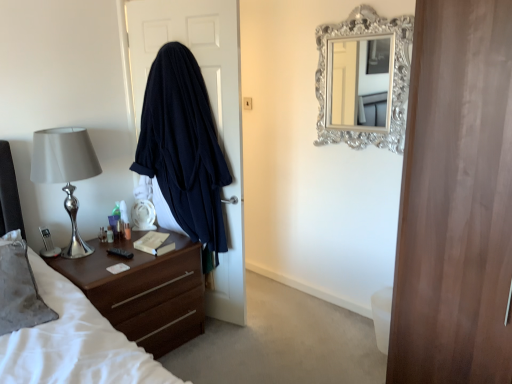
Question: Can you confirm if black plastic remote control at left is positioned to the right of translucent plastic bottle at left, which is the second bottle from right to left?

Choices:
 (A) yes
 (B) no

Answer: (A)

Question: Does black plastic remote control at left have a larger size compared to translucent plastic bottle at left, which appears as the 2th bottle when viewed from the left?

Choices:
 (A) yes
 (B) no

Answer: (A)

Question: Is black plastic remote control at left outside translucent plastic bottle at left, which appears as the 2th bottle when viewed from the left?

Choices:
 (A) yes
 (B) no

Answer: (A)

Question: Is the surface of black plastic remote control at left in direct contact with translucent plastic bottle at left, which is the second bottle from right to left?

Choices:
 (A) no
 (B) yes

Answer: (A)

Question: Is black plastic remote control at left facing towards translucent plastic bottle at left, which is the second bottle from right to left?

Choices:
 (A) no
 (B) yes

Answer: (A)

Question: In terms of width, does hardcover book at center look wider or thinner when compared to translucent plastic bottle at left, which appears as the 2th bottle when viewed from the left?

Choices:
 (A) wide
 (B) thin

Answer: (A)

Question: From the image's perspective, is hardcover book at center positioned above or below translucent plastic bottle at left, which appears as the 2th bottle when viewed from the left?

Choices:
 (A) below
 (B) above

Answer: (A)

Question: Is point (161, 243) positioned closer to the camera than point (111, 233)?

Choices:
 (A) farther
 (B) closer

Answer: (B)

Question: Based on their sizes in the image, would you say hardcover book at center is bigger or smaller than translucent plastic bottle at left, which is the second bottle from right to left?

Choices:
 (A) small
 (B) big

Answer: (B)

Question: From a real-world perspective, relative to translucent plastic bottle at left, the first bottle positioned from the left, is black plastic remote control at left vertically above or below?

Choices:
 (A) above
 (B) below

Answer: (B)

Question: Is black plastic remote control at left in front of or behind translucent plastic bottle at left, marked as the 3th bottle in a right-to-left arrangement, in the image?

Choices:
 (A) front
 (B) behind

Answer: (A)

Question: Based on their sizes in the image, would you say black plastic remote control at left is bigger or smaller than translucent plastic bottle at left, the first bottle positioned from the left?

Choices:
 (A) small
 (B) big

Answer: (B)

Question: Looking at their shapes, would you say black plastic remote control at left is wider or thinner than translucent plastic bottle at left, marked as the 3th bottle in a right-to-left arrangement?

Choices:
 (A) thin
 (B) wide

Answer: (B)

Question: Is dark blue fabric at left wider or thinner than translucent plastic bottle at left, which appears as the 2th bottle when viewed from the left?

Choices:
 (A) thin
 (B) wide

Answer: (B)

Question: From a real-world perspective, is dark blue fabric at left physically located above or below translucent plastic bottle at left, which is the second bottle from right to left?

Choices:
 (A) below
 (B) above

Answer: (B)